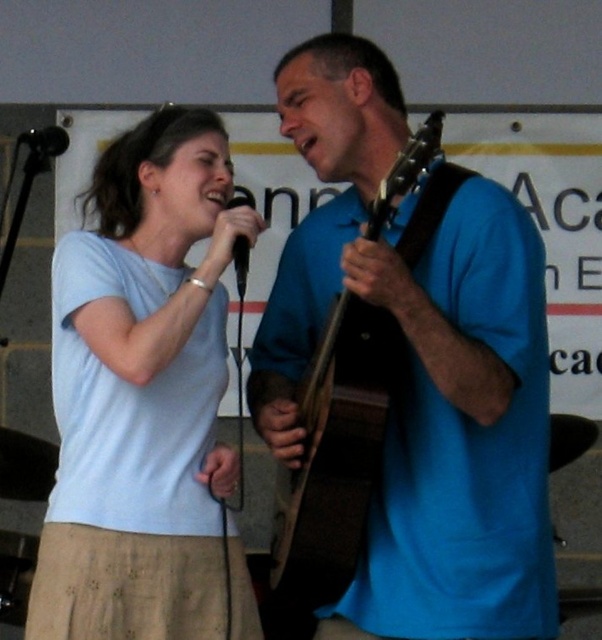
Between point (214, 285) and point (249, 195), which one is positioned behind?

The point (249, 195) is behind.

Which is more to the right, light blue cotton shirt at center or black matte microphone at center?

From the viewer's perspective, black matte microphone at center appears more on the right side.

Which is in front, point (226, 310) or point (244, 248)?

Point (244, 248)

Identify the location of light blue cotton shirt at center. Image resolution: width=602 pixels, height=640 pixels. (141, 394).

Measure the distance between blue matte guitar at center and camera.

The distance of blue matte guitar at center from camera is 6.22 feet.

Who is taller, blue matte guitar at center or black matte microphone at center?

Standing taller between the two is blue matte guitar at center.

Is point (296, 262) less distant than point (234, 260)?

No, (296, 262) is behind (234, 260).

The height and width of the screenshot is (640, 602). In order to click on blue matte guitar at center in this screenshot , I will do `click(418, 369)`.

Measure the distance between point [287,77] and camera.

Point [287,77] and camera are 2.19 meters apart from each other.

From the picture: Which of these two, blue matte guitar at center or black matte microphone at upper left, stands shorter?

With less height is black matte microphone at upper left.

Find the location of a particular element. This screenshot has height=640, width=602. blue matte guitar at center is located at coordinates (418, 369).